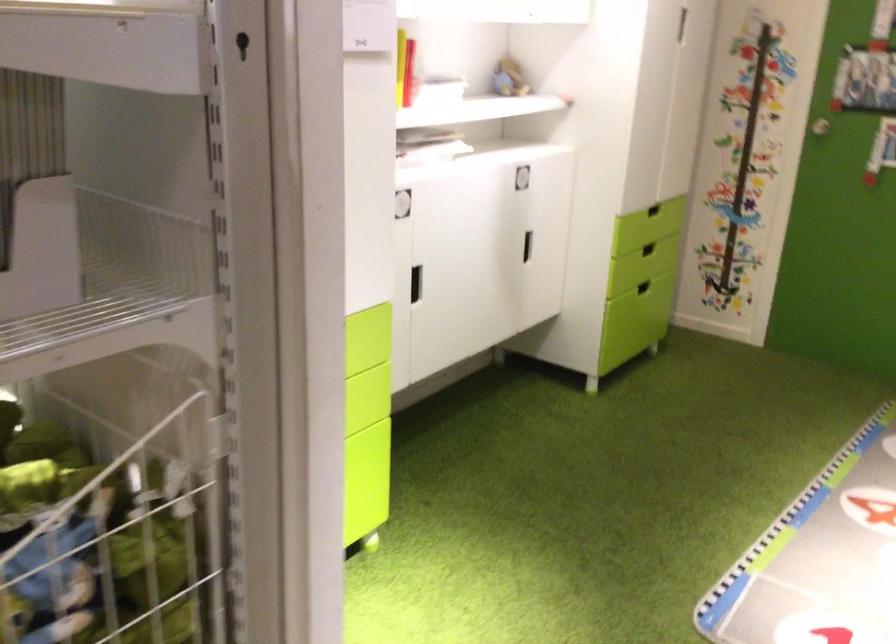
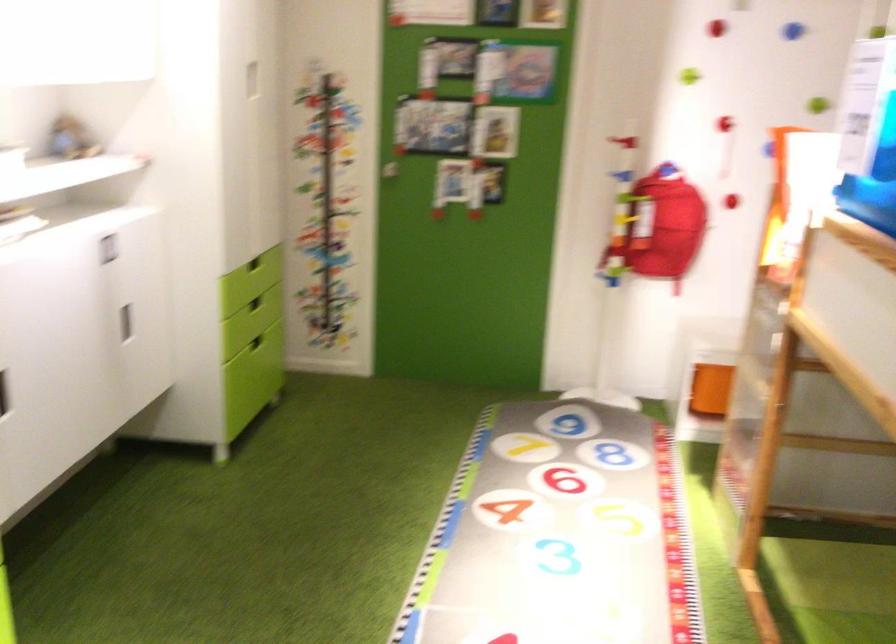
Locate, in the second image, the point that corresponds to pixel 515 245 in the first image.

(125, 323)